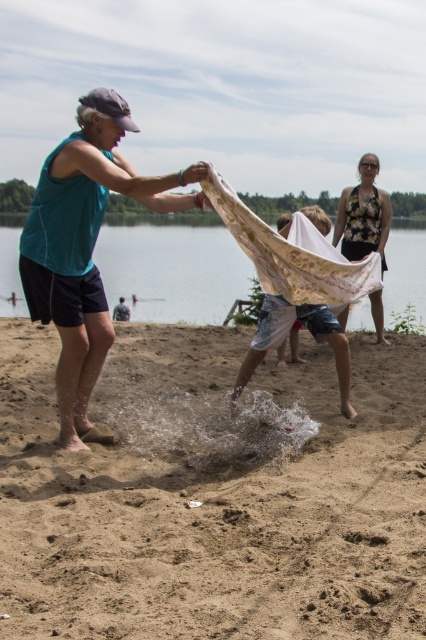
Question: In this image, where is brown sandy beach at center located relative to white lace towel at center?

Choices:
 (A) above
 (B) below

Answer: (B)

Question: Does brown sandy beach at center appear under translucent fabric water at center?

Choices:
 (A) yes
 (B) no

Answer: (A)

Question: Can you confirm if brown sandy beach at center is positioned to the right of floral fabric dress at upper right?

Choices:
 (A) yes
 (B) no

Answer: (B)

Question: Based on their relative distances, which object is nearer to the translucent fabric water at center?

Choices:
 (A) floral fabric dress at upper right
 (B) white lace towel at center
 (C) teal fabric at center
 (D) brown sandy beach at center

Answer: (A)

Question: Estimate the real-world distances between objects in this image. Which object is farther from the white lace towel at center?

Choices:
 (A) teal fabric at center
 (B) brown sandy beach at center

Answer: (A)

Question: Which point is farther from the camera taking this photo?

Choices:
 (A) (55, 323)
 (B) (247, 365)

Answer: (B)